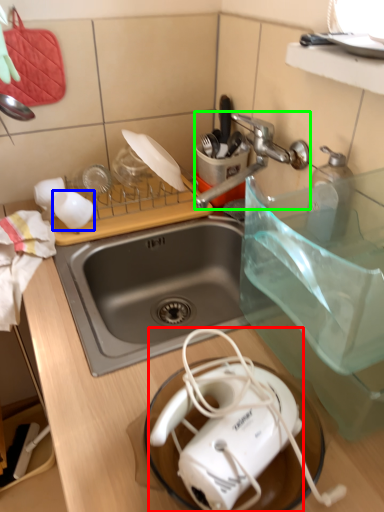
Question: Which object is the closest to the toaster (highlighted by a red box)? Choose among these: coffee cup (highlighted by a blue box) or faucet (highlighted by a green box).

Choices:
 (A) coffee cup
 (B) faucet

Answer: (B)